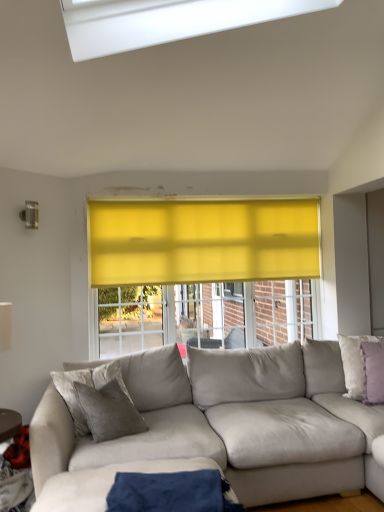
The height and width of the screenshot is (512, 384). What do you see at coordinates (373, 372) in the screenshot?
I see `purple velvet pillow at right, the 1th pillow viewed from the front` at bounding box center [373, 372].

The image size is (384, 512). Describe the element at coordinates (13, 467) in the screenshot. I see `wooden textured table at lower left` at that location.

Locate an element on the screen. The height and width of the screenshot is (512, 384). suede beige couch at lower right is located at coordinates (231, 422).

Based on their positions, is suede beige couch at lower right located to the left or right of white matte table lamp at left?

Based on their positions, suede beige couch at lower right is located to the right of white matte table lamp at left.

Between suede beige couch at lower right and white matte table lamp at left, which one is positioned in front?

suede beige couch at lower right is in front.

Locate an element on the screen. Image resolution: width=384 pixels, height=512 pixels. studio couch below the white matte table lamp at left (from a real-world perspective) is located at coordinates (231, 422).

In the scene shown: Is suede beige couch at lower right thinner than white matte table lamp at left?

No.

Is suede beige couch at lower right closer to the viewer compared to purple velvet pillow at right, the 1th pillow positioned from the back?

Yes, it is.

How many degrees apart are the facing directions of suede beige couch at lower right and purple velvet pillow at right, the 1th pillow positioned from the back?

The facing directions of suede beige couch at lower right and purple velvet pillow at right, the 1th pillow positioned from the back, are 16.9 degrees apart.

Is suede beige couch at lower right beside purple velvet pillow at right, the 1th pillow positioned from the back?

suede beige couch at lower right and purple velvet pillow at right, the 1th pillow positioned from the back, are not in contact.

Is suede beige couch at lower right taller or shorter than purple velvet pillow at right, the 1th pillow positioned from the back?

suede beige couch at lower right is taller than purple velvet pillow at right, the 1th pillow positioned from the back.

Considering the positions of points (227, 495) and (361, 399), is point (227, 495) farther from camera compared to point (361, 399)?

No.

Is blue fabric at lower center far away from purple velvet pillow at right, which ranks as the 2th pillow in front-to-back order?

That's right, there is a large distance between blue fabric at lower center and purple velvet pillow at right, which ranks as the 2th pillow in front-to-back order.

Does blue fabric at lower center have a smaller size compared to purple velvet pillow at right, the 1th pillow positioned from the back?

No, blue fabric at lower center is not smaller than purple velvet pillow at right, the 1th pillow positioned from the back.

There is a suede beige couch at lower right. At what (x,y) coordinates should I click in order to perform the action: click on the 1st pillow above it (from a real-world perspective). Please return your answer as a coordinate pair (x, y). The image size is (384, 512). Looking at the image, I should click on (354, 362).

How many degrees apart are the facing directions of purple velvet pillow at right, which ranks as the 2th pillow in front-to-back order, and suede beige couch at lower right?

16.9 degrees.

Consider the image. Is purple velvet pillow at right, the 1th pillow positioned from the back, not close to suede beige couch at lower right?

purple velvet pillow at right, the 1th pillow positioned from the back, is actually quite close to suede beige couch at lower right.

Which object is wider, purple velvet pillow at right, which ranks as the 2th pillow in front-to-back order, or suede beige couch at lower right?

suede beige couch at lower right.

Considering the sizes of objects blue fabric at lower center and wooden textured table at lower left in the image provided, who is wider, blue fabric at lower center or wooden textured table at lower left?

With larger width is blue fabric at lower center.

Who is bigger, blue fabric at lower center or wooden textured table at lower left?

With larger size is blue fabric at lower center.

This screenshot has width=384, height=512. Identify the location of plain in front of the wooden textured table at lower left. (105, 483).

From a real-world perspective, is purple velvet pillow at right, which is counted as the 2th pillow, starting from the back, physically above purple velvet pillow at right, which ranks as the 2th pillow in front-to-back order?

Yes, from a real-world perspective, purple velvet pillow at right, which is counted as the 2th pillow, starting from the back, is over purple velvet pillow at right, which ranks as the 2th pillow in front-to-back order

Which is behind, purple velvet pillow at right, which is counted as the 2th pillow, starting from the back, or purple velvet pillow at right, which ranks as the 2th pillow in front-to-back order?

purple velvet pillow at right, which ranks as the 2th pillow in front-to-back order, is further from the camera.

Identify the location of pillow located on the left of purple velvet pillow at right, the 1th pillow positioned from the back. (373, 372).

Is purple velvet pillow at right, the 1th pillow viewed from the front, taller than purple velvet pillow at right, which ranks as the 2th pillow in front-to-back order?

Incorrect, the height of purple velvet pillow at right, the 1th pillow viewed from the front, is not larger of that of purple velvet pillow at right, which ranks as the 2th pillow in front-to-back order.

How far apart are purple velvet pillow at right, which is counted as the 2th pillow, starting from the back, and suede beige couch at lower right?

36.45 inches.

From a real-world perspective, relative to suede beige couch at lower right, is purple velvet pillow at right, which is counted as the 2th pillow, starting from the back, vertically above or below?

From a real-world perspective, purple velvet pillow at right, which is counted as the 2th pillow, starting from the back, is physically above suede beige couch at lower right.

Can suede beige couch at lower right be found inside purple velvet pillow at right, the 1th pillow viewed from the front?

No, purple velvet pillow at right, the 1th pillow viewed from the front, does not contain suede beige couch at lower right.

In order to click on table lamp lying above the suede beige couch at lower right (from the image's perspective) in this screenshot , I will do `click(9, 424)`.

From the suede beige couch at lower right, count 2nd pillow to the right and point to it. Please provide its 2D coordinates.

[(354, 362)]

Based on their spatial positions, is suede beige couch at lower right or purple velvet pillow at right, which is counted as the 2th pillow, starting from the back, closer to blue fabric at lower center?

The object closer to blue fabric at lower center is suede beige couch at lower right.

From the image, which object appears to be nearer to purple velvet pillow at right, which is counted as the 2th pillow, starting from the back, blue fabric at lower center or white matte table lamp at left?

blue fabric at lower center lies closer to purple velvet pillow at right, which is counted as the 2th pillow, starting from the back, than the other object.

Considering their positions, is suede beige couch at lower right positioned further to purple velvet pillow at right, the 1th pillow positioned from the back, than wooden textured table at lower left?

The object further to purple velvet pillow at right, the 1th pillow positioned from the back, is wooden textured table at lower left.

Estimate the real-world distances between objects in this image. Which object is further from suede beige couch at lower right, wooden textured table at lower left or purple velvet pillow at right, the 1th pillow viewed from the front?

wooden textured table at lower left lies further to suede beige couch at lower right than the other object.

Based on their spatial positions, is purple velvet pillow at right, which ranks as the 2th pillow in front-to-back order, or white matte table lamp at left further from blue fabric at lower center?

purple velvet pillow at right, which ranks as the 2th pillow in front-to-back order, is further to blue fabric at lower center.

Considering their positions, is purple velvet pillow at right, the 1th pillow positioned from the back, positioned further to blue fabric at lower center than wooden textured table at lower left?

purple velvet pillow at right, the 1th pillow positioned from the back.

In the scene shown: Based on their spatial positions, is purple velvet pillow at right, the 1th pillow viewed from the front, or blue fabric at lower center further from white matte table lamp at left?

Among the two, purple velvet pillow at right, the 1th pillow viewed from the front, is located further to white matte table lamp at left.

Which object lies nearer to the anchor point purple velvet pillow at right, the 1th pillow viewed from the front, white matte table lamp at left or suede beige couch at lower right?

suede beige couch at lower right lies closer to purple velvet pillow at right, the 1th pillow viewed from the front, than the other object.

Find the location of a particular element. table between white matte table lamp at left and suede beige couch at lower right in the horizontal direction is located at coordinates (13, 467).

Locate an element on the screen. The image size is (384, 512). pillow between blue fabric at lower center and purple velvet pillow at right, which ranks as the 2th pillow in front-to-back order is located at coordinates (373, 372).

Where is `plain between white matte table lamp at left and purple velvet pillow at right, the 1th pillow viewed from the front`? This screenshot has width=384, height=512. plain between white matte table lamp at left and purple velvet pillow at right, the 1th pillow viewed from the front is located at coordinates (105, 483).

Locate an element on the screen. The width and height of the screenshot is (384, 512). plain between wooden textured table at lower left and purple velvet pillow at right, which is counted as the 2th pillow, starting from the back, from left to right is located at coordinates (105, 483).